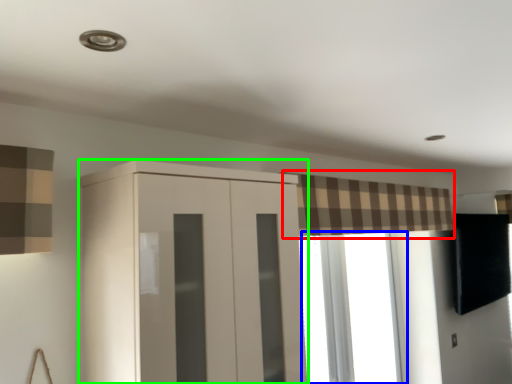
Question: Estimate the real-world distances between objects in this image. Which object is closer to curtain (highlighted by a red box), window (highlighted by a blue box) or cupboard (highlighted by a green box)?

Choices:
 (A) window
 (B) cupboard

Answer: (A)